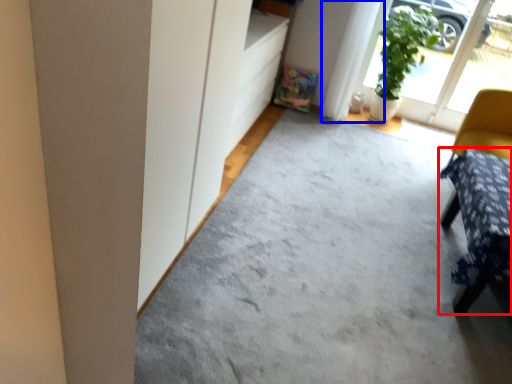
Question: Which object is closer to the camera taking this photo, furniture (highlighted by a red box) or curtain (highlighted by a blue box)?

Choices:
 (A) furniture
 (B) curtain

Answer: (A)